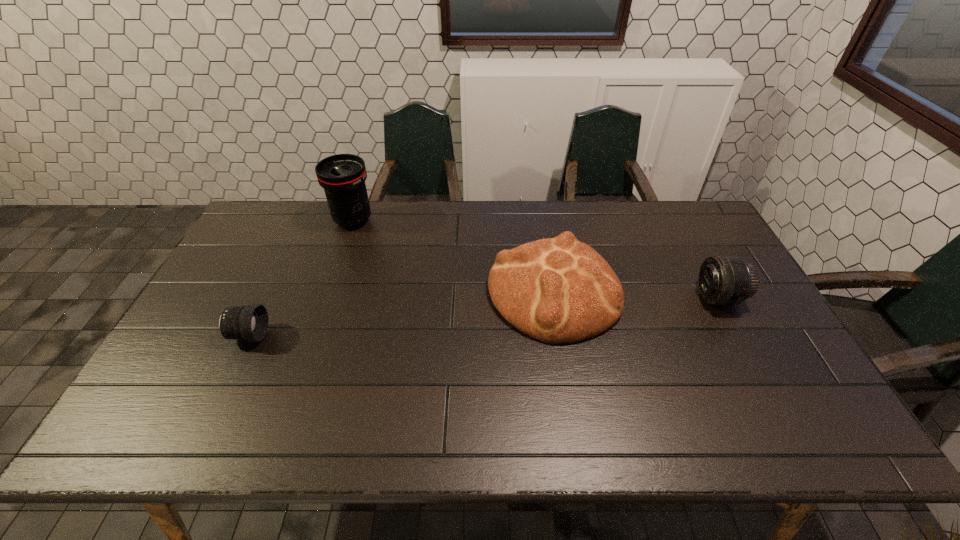
Image resolution: width=960 pixels, height=540 pixels. Find the location of `vacant region located on the front-facing side of the rightmost object`. vacant region located on the front-facing side of the rightmost object is located at coordinates (622, 298).

You are a GUI agent. You are given a task and a screenshot of the screen. Output one action in this format:
    pyautogui.click(x=<x>, y=<y>)
    Task: Click on the vacant space situated on the front-facing side of the rightmost object
    
    Given the screenshot: What is the action you would take?
    pyautogui.click(x=564, y=298)

You are a GUI agent. You are given a task and a screenshot of the screen. Output one action in this format:
    pyautogui.click(x=<x>, y=<y>)
    Task: Click on the free space located 0.400m at the front element of the nearest telephoto lens
    
    Given the screenshot: What is the action you would take?
    pyautogui.click(x=416, y=335)

Identify the location of object that is at the far edge. click(x=343, y=176).

This screenshot has height=540, width=960. I want to click on object that is at the left edge, so click(250, 323).

The width and height of the screenshot is (960, 540). Find the location of `object at the right edge`. object at the right edge is located at coordinates pos(723,280).

Locate an element on the screen. The image size is (960, 540). vacant space at the far edge is located at coordinates (436, 210).

What are the coordinates of `vacant area at the left edge` in the screenshot? It's located at point(266,251).

This screenshot has height=540, width=960. Identify the location of vacant space at the far left corner of the desktop. (287, 212).

This screenshot has width=960, height=540. Identify the location of vacant space at the near left corner of the desktop. (175, 422).